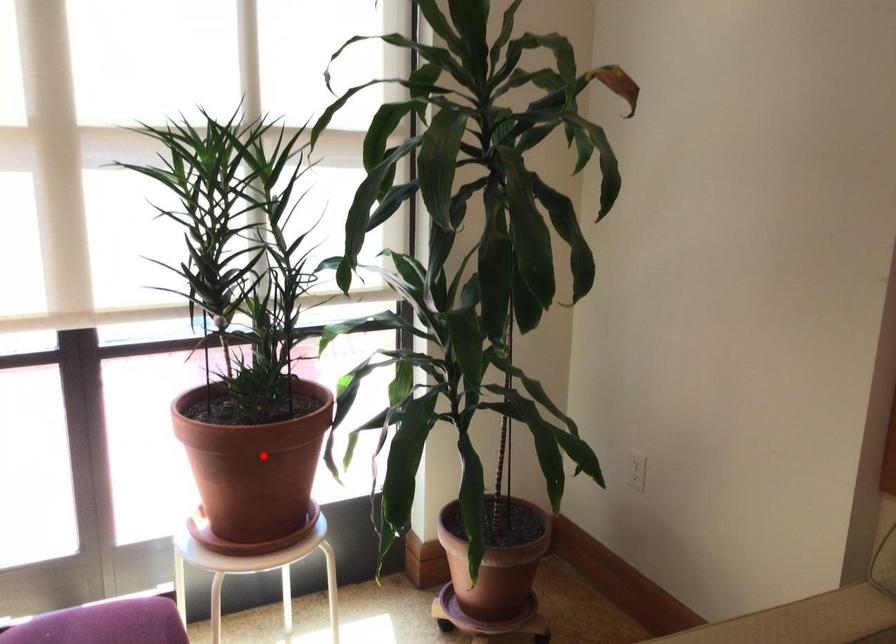
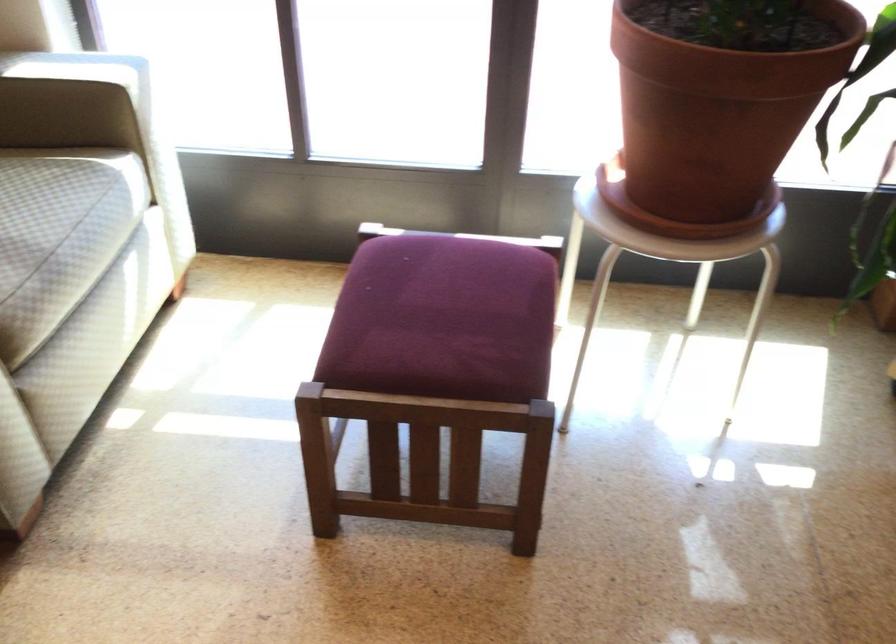
Question: I am providing you with two images of the same scene from different viewpoints. A red point is marked on the first image. Is the red point's position out of view in image 2?

Choices:
 (A) Yes
 (B) No

Answer: (B)